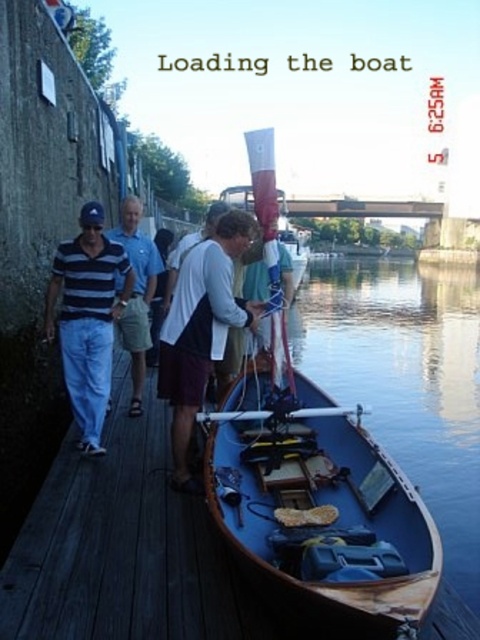
You are standing on the wooden dock and want to take a photo of the wooden boat at lower right using a camera that has a maximum focus range of 5 meters. Can you capture the boat clearly without moving closer?

The wooden boat at lower right is 4.65 meters away from the camera, which is within the maximum focus range of 5 meters. Therefore, you can capture the boat clearly without moving closer.

You are organizing a boat trip and need to ensure that the clothing items are appropriately sized for your team members. Given that the striped cotton shirt at left and the striped cotton polo shirt at left are both available, which one would you choose if you need a larger size?

The striped cotton shirt at left has a larger size compared to the striped cotton polo shirt at left, so you should choose the striped cotton shirt at left for a larger size.